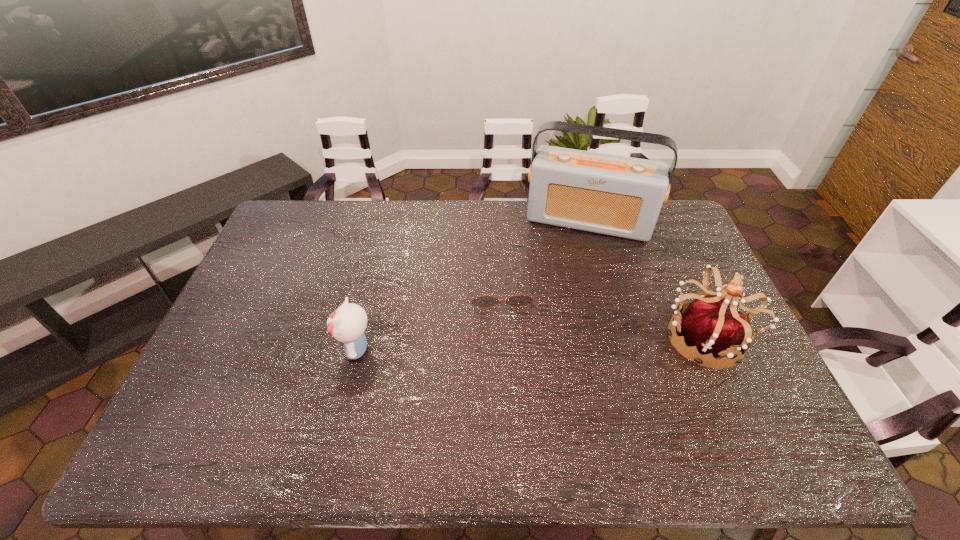
At what (x,y) coordinates should I click in order to perform the action: click on free point located on the front-facing side of the radio receiver. Please return your answer as a coordinate pair (x, y). Image resolution: width=960 pixels, height=540 pixels. Looking at the image, I should click on (558, 325).

You are a GUI agent. You are given a task and a screenshot of the screen. Output one action in this format:
    pyautogui.click(x=<x>, y=<y>)
    Task: Click on the blank space located on the front-facing side of the radio receiver
    
    Given the screenshot: What is the action you would take?
    pyautogui.click(x=564, y=298)

Locate an element on the screen. The image size is (960, 540). vacant space located 0.350m on the front-facing side of the radio receiver is located at coordinates (560, 317).

Image resolution: width=960 pixels, height=540 pixels. I want to click on vacant space located on the face of the sunglasses, so click(512, 409).

You are a GUI agent. You are given a task and a screenshot of the screen. Output one action in this format:
    pyautogui.click(x=<x>, y=<y>)
    Task: Click on the free space located 0.160m on the face of the sunglasses
    The image size is (960, 540).
    Given the screenshot: What is the action you would take?
    pyautogui.click(x=507, y=353)

Where is `free space located on the face of the sunglasses`? This screenshot has height=540, width=960. free space located on the face of the sunglasses is located at coordinates (507, 353).

I want to click on object at the far edge, so click(621, 196).

The height and width of the screenshot is (540, 960). In order to click on tiara that is positioned at the right edge in this screenshot , I will do `click(708, 324)`.

Identify the location of radio receiver that is at the right edge. click(621, 196).

Where is `object that is at the far right corner`? object that is at the far right corner is located at coordinates (621, 196).